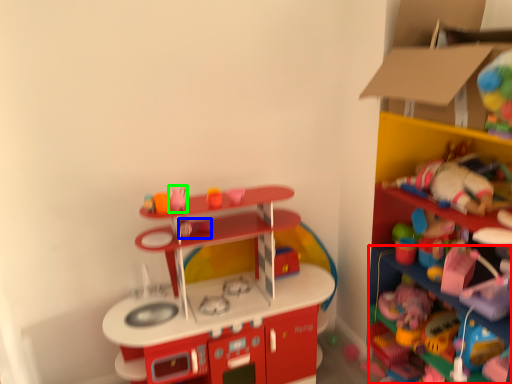
Question: Which is nearer to the shelf (highlighted by a red box)? toy (highlighted by a blue box) or toy (highlighted by a green box).

Choices:
 (A) toy
 (B) toy

Answer: (A)